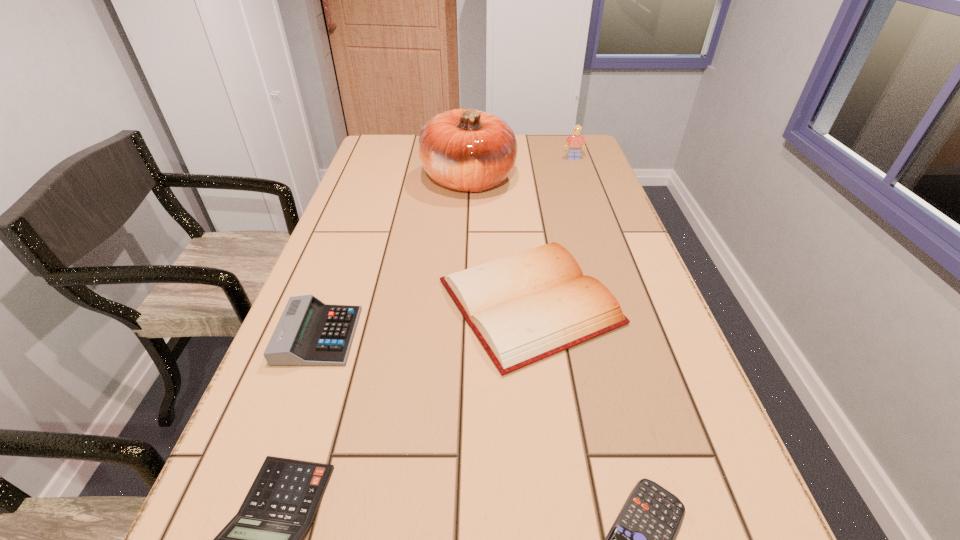
This screenshot has height=540, width=960. I want to click on vacant space that is in between the tallest object and the Bible, so click(499, 241).

Identify the location of object that is the third closest to the fifth shortest object. Image resolution: width=960 pixels, height=540 pixels. (309, 333).

Identify which object is the third closest to the second tallest object. Please provide its 2D coordinates. Your answer should be formatted as a tuple, i.e. [(x, y)], where the tuple contains the x and y coordinates of a point satisfying the conditions above.

[(309, 333)]

In order to click on the third closest calculator relative to the Lego in this screenshot , I will do `click(264, 539)`.

Locate an element on the screen. This screenshot has width=960, height=540. calculator identified as the second closest to the second tallest object is located at coordinates (642, 539).